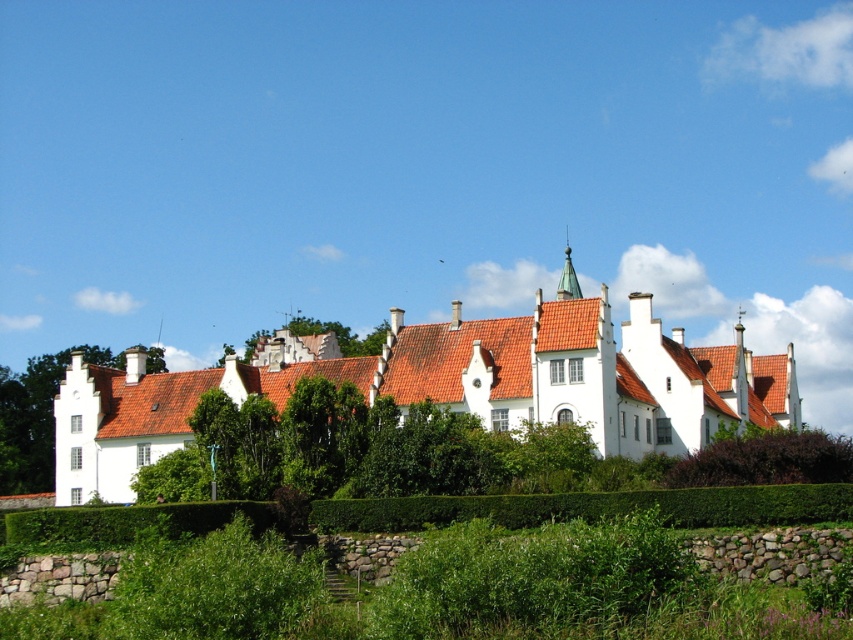
Can you confirm if green leafy tree at left is wider than shiny copper spire at upper center?

Indeed, green leafy tree at left has a greater width compared to shiny copper spire at upper center.

Does green leafy tree at left appear over shiny copper spire at upper center?

Incorrect, green leafy tree at left is not positioned above shiny copper spire at upper center.

Does point (50, 358) come farther from viewer compared to point (572, 292)?

Yes, point (50, 358) is farther from viewer.

Where is `green leafy tree at left`? green leafy tree at left is located at coordinates (35, 417).

Does green leafy tree at left have a lesser width compared to green leafy hedge at center?

Yes.

Does green leafy tree at left have a greater height compared to green leafy hedge at center?

Indeed, green leafy tree at left has a greater height compared to green leafy hedge at center.

You are a GUI agent. You are given a task and a screenshot of the screen. Output one action in this format:
    pyautogui.click(x=<x>, y=<y>)
    Task: Click on the green leafy tree at left
    
    Given the screenshot: What is the action you would take?
    pyautogui.click(x=35, y=417)

The image size is (853, 640). I want to click on green leafy tree at left, so tap(35, 417).

Does green leafy tree at center have a greater width compared to shiny copper spire at upper center?

Correct, the width of green leafy tree at center exceeds that of shiny copper spire at upper center.

Is point (376, 353) farther from camera compared to point (561, 291)?

Yes.

Which is behind, point (368, 344) or point (570, 269)?

The point (368, 344) is more distant.

This screenshot has width=853, height=640. I want to click on green leafy tree at center, so click(x=340, y=333).